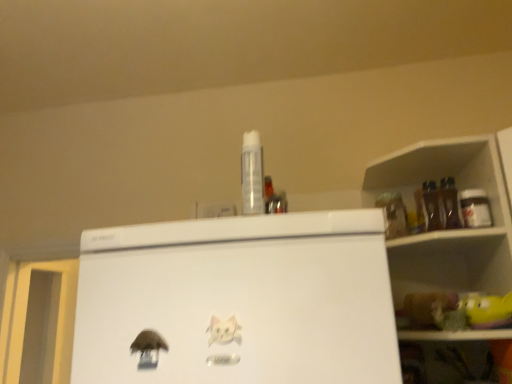
Question: Is transparent plastic spray can at center, the 2th bottle positioned from the back, wider than white paper cat at center?

Choices:
 (A) no
 (B) yes

Answer: (B)

Question: Is transparent plastic spray can at center, which ranks as the 1th bottle in left-to-right order, next to white paper cat at center and touching it?

Choices:
 (A) yes
 (B) no

Answer: (B)

Question: Is transparent plastic spray can at center, which ranks as the 1th bottle in left-to-right order, oriented towards white paper cat at center?

Choices:
 (A) yes
 (B) no

Answer: (B)

Question: Is the position of transparent plastic spray can at center, which is the 1th bottle from front to back, less distant than that of white paper cat at center?

Choices:
 (A) no
 (B) yes

Answer: (A)

Question: Is transparent plastic spray can at center, which is the 1th bottle from front to back, not near white paper cat at center?

Choices:
 (A) yes
 (B) no

Answer: (B)

Question: Is point (232, 339) closer or farther from the camera than point (251, 162)?

Choices:
 (A) farther
 (B) closer

Answer: (B)

Question: In the image, is white paper cat at center on the left side or the right side of transparent plastic spray can at center, which ranks as the 2th bottle in right-to-left order?

Choices:
 (A) left
 (B) right

Answer: (A)

Question: From a real-world perspective, relative to transparent plastic spray can at center, the 2th bottle positioned from the back, is white paper cat at center vertically above or below?

Choices:
 (A) above
 (B) below

Answer: (B)

Question: In terms of height, does white paper cat at center look taller or shorter compared to transparent plastic spray can at center, which ranks as the 1th bottle in left-to-right order?

Choices:
 (A) tall
 (B) short

Answer: (B)

Question: Looking at their shapes, would you say metallic silver jar at upper right, the first bottle positioned from the right, is wider or thinner than matte plastic shelf at upper right?

Choices:
 (A) wide
 (B) thin

Answer: (B)

Question: Considering the positions of metallic silver jar at upper right, acting as the first bottle starting from the back, and matte plastic shelf at upper right in the image, is metallic silver jar at upper right, acting as the first bottle starting from the back, bigger or smaller than matte plastic shelf at upper right?

Choices:
 (A) small
 (B) big

Answer: (A)

Question: From the image's perspective, is metallic silver jar at upper right, the first bottle positioned from the right, positioned above or below matte plastic shelf at upper right?

Choices:
 (A) above
 (B) below

Answer: (A)

Question: Is point (478, 192) closer or farther from the camera than point (480, 332)?

Choices:
 (A) closer
 (B) farther

Answer: (B)

Question: Looking at their shapes, would you say matte plastic shelf at upper right is wider or thinner than transparent plastic spray can at center, which is the 1th bottle from front to back?

Choices:
 (A) thin
 (B) wide

Answer: (B)

Question: Is matte plastic shelf at upper right in front of or behind transparent plastic spray can at center, which is the 1th bottle from front to back, in the image?

Choices:
 (A) behind
 (B) front

Answer: (B)